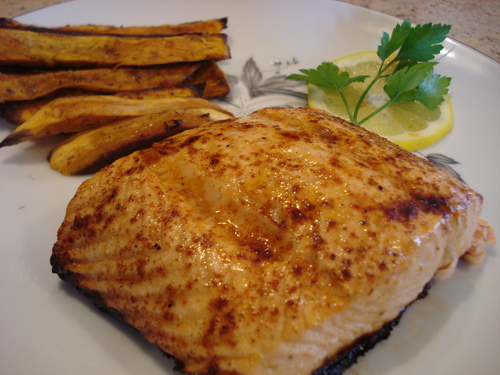
Locate an element on the screen. The width and height of the screenshot is (500, 375). white plate is located at coordinates (34, 335), (465, 328), (477, 113).